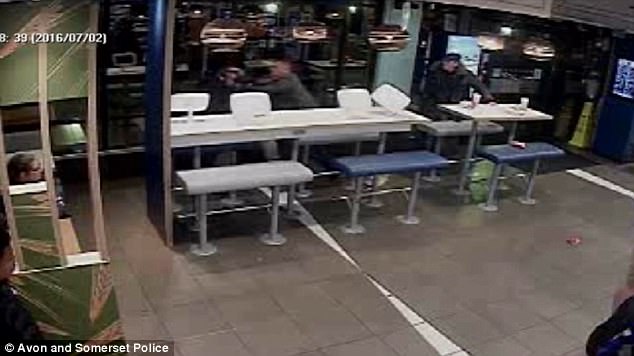
Locate an element on the screen. window is located at coordinates (137, 35), (274, 34), (366, 17).